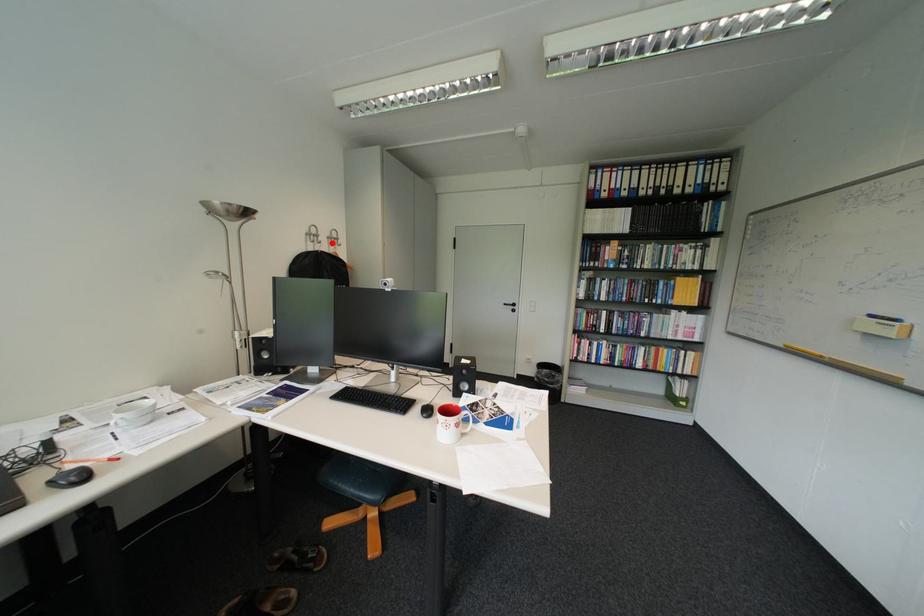
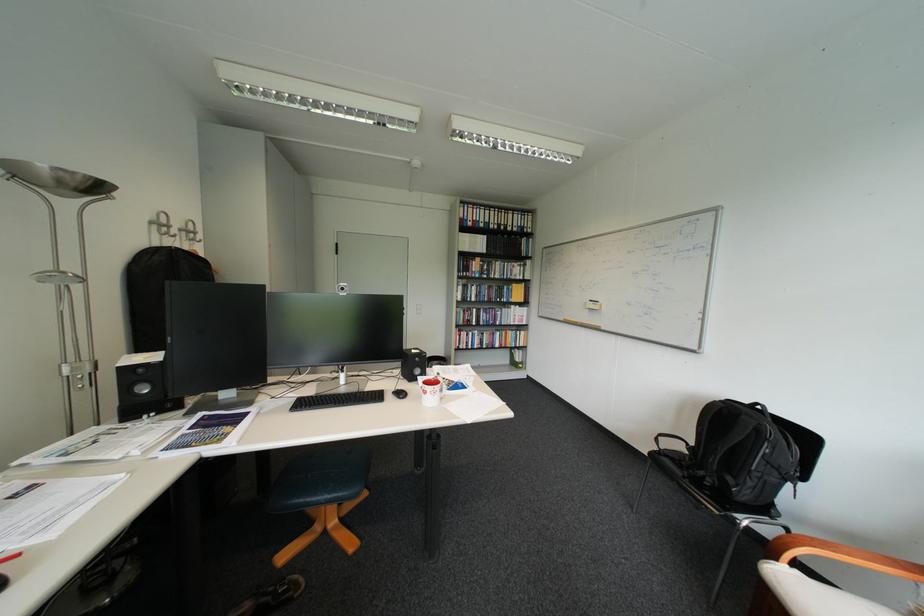
Question: I am providing you with two images of the same scene from different viewpoints. Image1 has a red point marked. In image2, the corresponding 3D location appears at what relative position? Reply with the corresponding letter.

Choices:
 (A) Closer
 (B) Farther

Answer: (B)